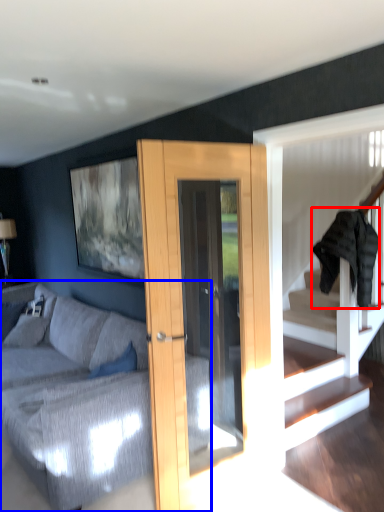
Question: Which object appears closest to the camera in this image, clothe (highlighted by a red box) or studio couch (highlighted by a blue box)?

Choices:
 (A) clothe
 (B) studio couch

Answer: (B)